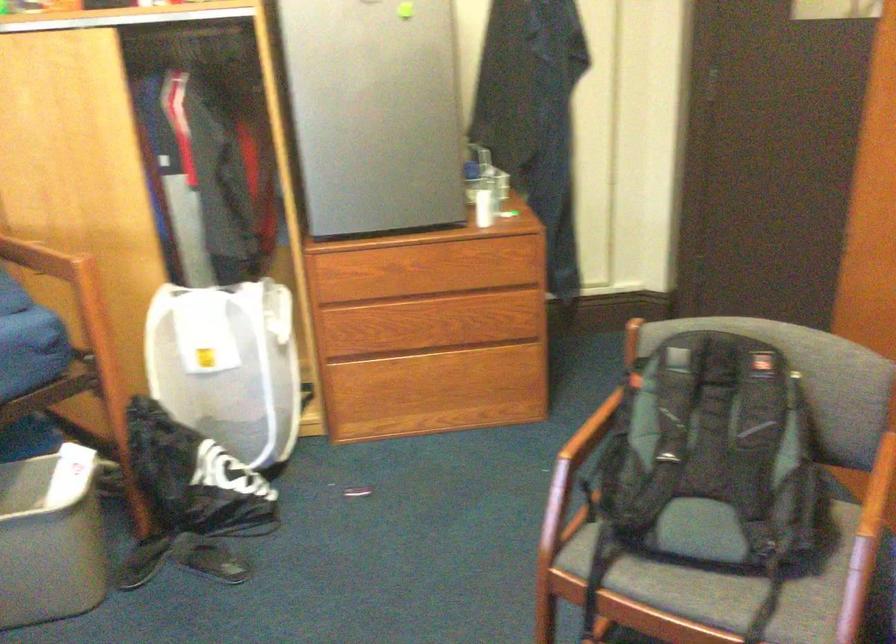
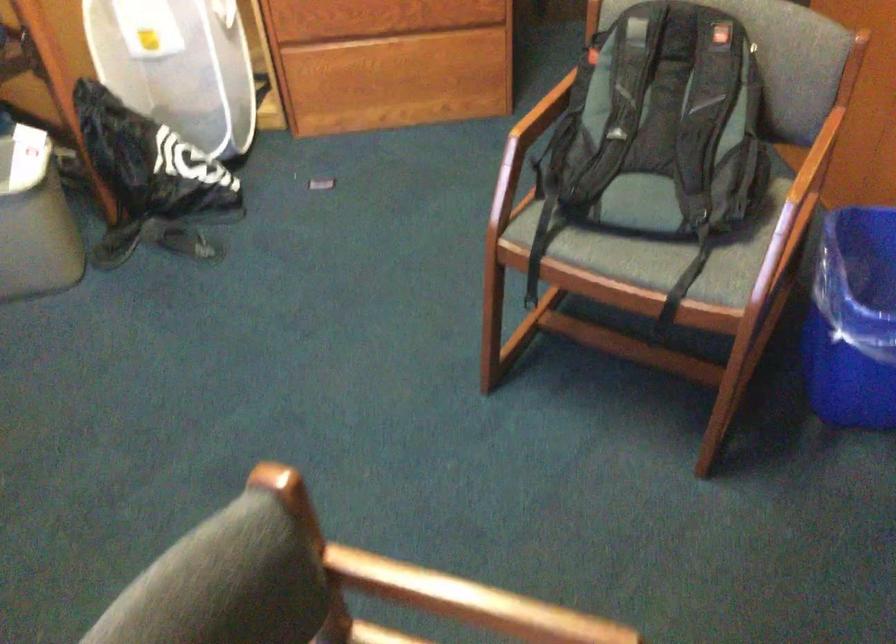
In a continuous first-person perspective shot, in which direction is the camera moving?

The cameraman moved toward right, backward.